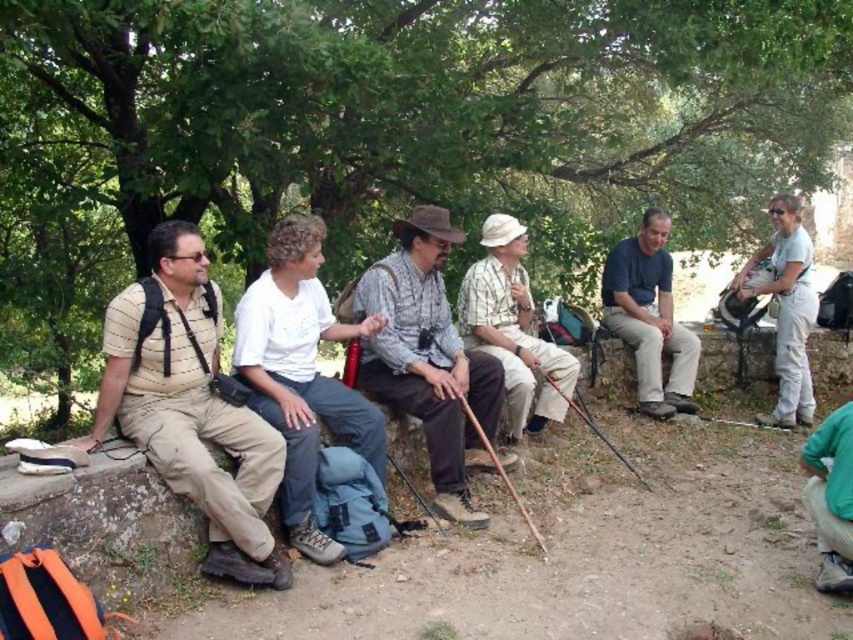
Question: Which point appears closest to the camera in this image?

Choices:
 (A) (799, 376)
 (B) (421, 243)
 (C) (165, 186)
 (D) (831, 504)

Answer: (D)

Question: Can you confirm if dark blue shirt at center is thinner than white cotton shirt at upper right?

Choices:
 (A) yes
 (B) no

Answer: (B)

Question: Which is farther from the plaid cotton shirt at center?

Choices:
 (A) green leafy tree at upper center
 (B) checkered fabric shirt at center
 (C) white cotton shirt at upper right
 (D) white cotton shirt at center

Answer: (A)

Question: Is green leafy tree at upper center to the left of checkered fabric shirt at center from the viewer's perspective?

Choices:
 (A) yes
 (B) no

Answer: (A)

Question: Is matte khaki pants at left to the right of green fabric pants at lower right from the viewer's perspective?

Choices:
 (A) no
 (B) yes

Answer: (A)

Question: Which point is closer to the camera?

Choices:
 (A) (397, 262)
 (B) (167, 458)
 (C) (811, 480)
 (D) (519, 381)

Answer: (B)